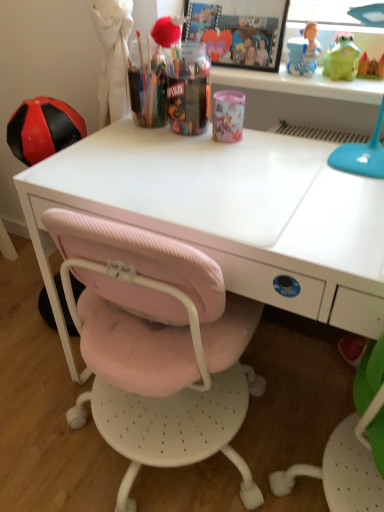
Question: From the image's perspective, is green rubber frog at upper right, the 2th toy positioned from the right, over matte green toy at upper right, which appears as the first toy when viewed from the right?

Choices:
 (A) no
 (B) yes

Answer: (B)

Question: Does green rubber frog at upper right, arranged as the first toy when viewed from the left, have a lesser width compared to matte green toy at upper right, which appears as the first toy when viewed from the right?

Choices:
 (A) no
 (B) yes

Answer: (A)

Question: Can you confirm if green rubber frog at upper right, the 2th toy positioned from the right, is taller than matte green toy at upper right, arranged as the second toy when viewed from the left?

Choices:
 (A) no
 (B) yes

Answer: (B)

Question: Considering the relative sizes of green rubber frog at upper right, the 2th toy positioned from the right, and matte green toy at upper right, arranged as the second toy when viewed from the left, in the image provided, is green rubber frog at upper right, the 2th toy positioned from the right, smaller than matte green toy at upper right, arranged as the second toy when viewed from the left,?

Choices:
 (A) yes
 (B) no

Answer: (B)

Question: Are green rubber frog at upper right, the 2th toy positioned from the right, and matte green toy at upper right, arranged as the second toy when viewed from the left, beside each other?

Choices:
 (A) yes
 (B) no

Answer: (A)

Question: From the image's perspective, is green rubber frog at upper right, the 2th toy positioned from the right, beneath matte green toy at upper right, which appears as the first toy when viewed from the right?

Choices:
 (A) yes
 (B) no

Answer: (B)

Question: Are white matte desk at center and matte green toy at upper right, arranged as the second toy when viewed from the left, located far from each other?

Choices:
 (A) yes
 (B) no

Answer: (B)

Question: Is white matte desk at center thinner than matte green toy at upper right, arranged as the second toy when viewed from the left?

Choices:
 (A) yes
 (B) no

Answer: (B)

Question: Does white matte desk at center turn towards matte green toy at upper right, arranged as the second toy when viewed from the left?

Choices:
 (A) no
 (B) yes

Answer: (A)

Question: Is white matte desk at center smaller than matte green toy at upper right, arranged as the second toy when viewed from the left?

Choices:
 (A) yes
 (B) no

Answer: (B)

Question: Considering the relative sizes of white matte desk at center and matte green toy at upper right, arranged as the second toy when viewed from the left, in the image provided, is white matte desk at center shorter than matte green toy at upper right, arranged as the second toy when viewed from the left,?

Choices:
 (A) no
 (B) yes

Answer: (A)

Question: From a real-world perspective, is white matte desk at center located higher than matte green toy at upper right, which appears as the first toy when viewed from the right?

Choices:
 (A) no
 (B) yes

Answer: (A)

Question: Does green rubber frog at upper right, the 2th toy positioned from the right, have a lesser width compared to translucent plastic container at center, the 2th stationery in the right-to-left sequence?

Choices:
 (A) no
 (B) yes

Answer: (B)